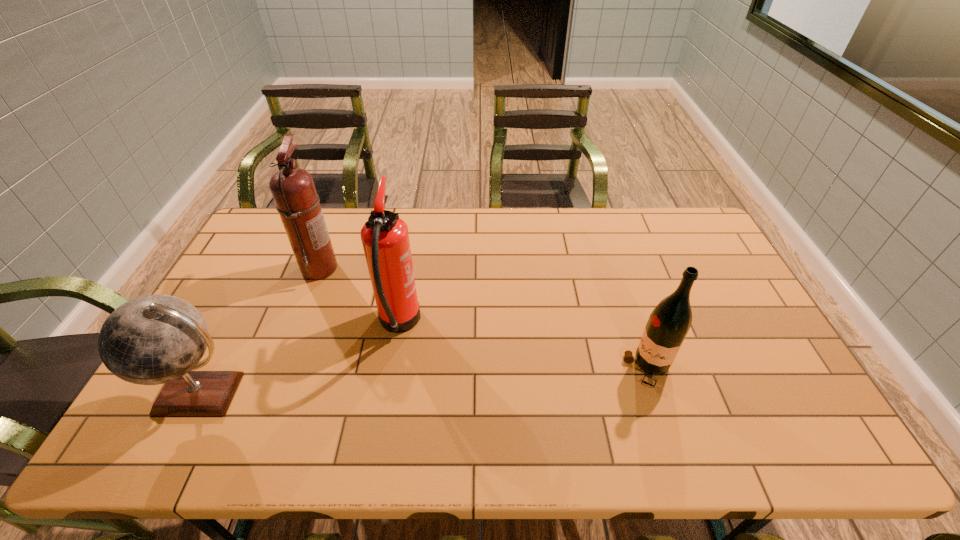
At what (x,y) coordinates should I click in order to perform the action: click on object present at the near edge. Please return your answer as a coordinate pair (x, y). Looking at the image, I should click on (154, 339).

The height and width of the screenshot is (540, 960). Find the location of `object located at the left edge`. object located at the left edge is located at coordinates (154, 339).

Identify the location of object that is at the near left corner. The height and width of the screenshot is (540, 960). click(x=154, y=339).

Find the location of a particular element. The image size is (960, 540). vacant area at the far edge is located at coordinates (570, 222).

Image resolution: width=960 pixels, height=540 pixels. Find the location of `vacant region at the near edge of the desktop`. vacant region at the near edge of the desktop is located at coordinates (261, 444).

What are the coordinates of `vacant position at the right edge of the desktop` in the screenshot? It's located at (791, 392).

Locate an element on the screen. This screenshot has width=960, height=540. blank space at the far right corner of the desktop is located at coordinates (690, 238).

You are a GUI agent. You are given a task and a screenshot of the screen. Output one action in this format:
    pyautogui.click(x=<x>, y=<y>)
    Task: Click on the free space that is in between the rightmost object and the globe
    This screenshot has width=960, height=540.
    Given the screenshot: What is the action you would take?
    pyautogui.click(x=425, y=381)

At what (x,y) coordinates should I click in order to perform the action: click on vacant area that lies between the nearer fire extinguisher and the leftmost object. Please return your answer as a coordinate pair (x, y). Image resolution: width=960 pixels, height=540 pixels. Looking at the image, I should click on (300, 359).

What are the coordinates of `unoccupied position between the left fire extinguisher and the second object from right to left` in the screenshot? It's located at (359, 296).